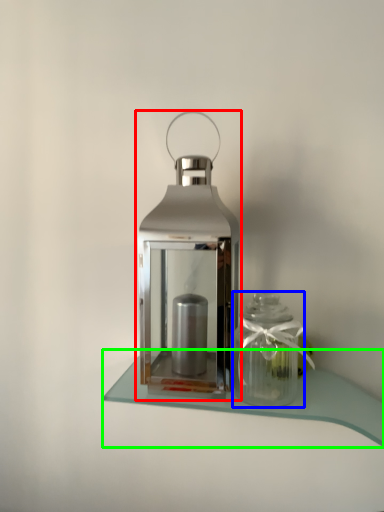
Question: Considering the real-world distances, which object is closest to lantern (highlighted by a red box)? glass vase (highlighted by a blue box) or table (highlighted by a green box).

Choices:
 (A) glass vase
 (B) table

Answer: (A)